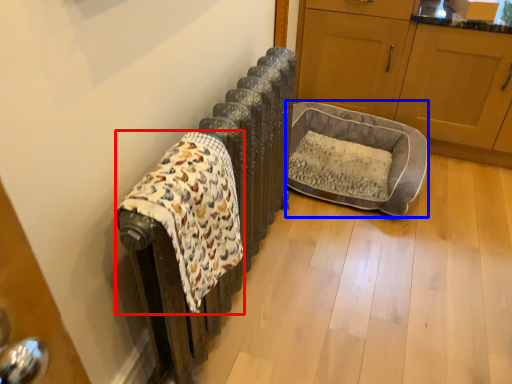
Question: Which of the following is the farthest to the observer, blanket (highlighted by a red box) or dog bed (highlighted by a blue box)?

Choices:
 (A) blanket
 (B) dog bed

Answer: (B)